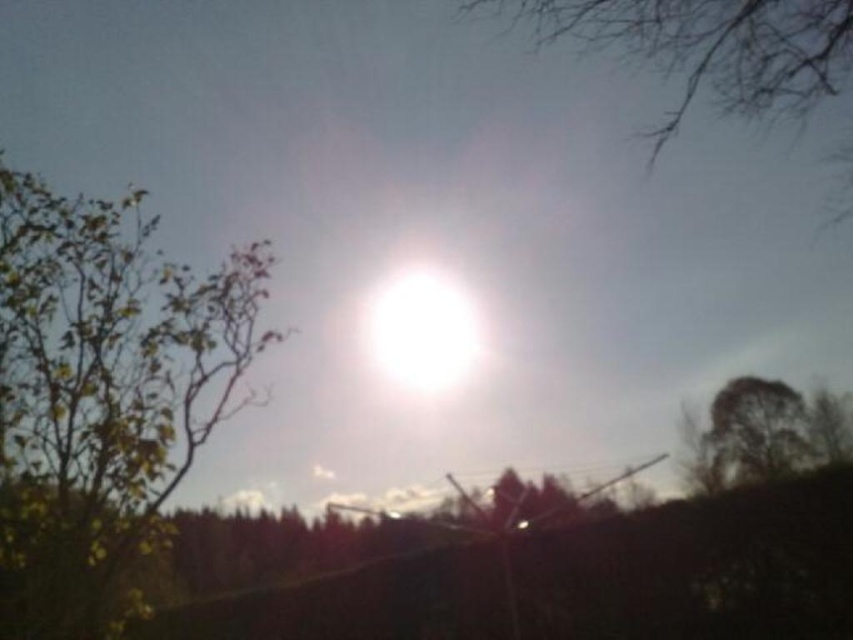
Question: Is the position of green leafy tree at left less distant than that of dark green textured tree at lower right?

Choices:
 (A) no
 (B) yes

Answer: (B)

Question: Based on their relative distances, which object is farther from the white glossy sun at center?

Choices:
 (A) green leafy tree at left
 (B) dark green textured tree at lower right

Answer: (B)

Question: Is the position of green leafy tree at left less distant than that of dark green textured tree at lower right?

Choices:
 (A) no
 (B) yes

Answer: (B)

Question: Is bare branches at upper right positioned behind dark green textured tree at lower right?

Choices:
 (A) yes
 (B) no

Answer: (B)

Question: Which of the following is the farthest from the observer?

Choices:
 (A) green leafy tree at left
 (B) white glossy sun at center
 (C) dark green textured tree at lower right
 (D) bare branches at upper right

Answer: (C)

Question: Among these objects, which one is nearest to the camera?

Choices:
 (A) dark green textured tree at lower right
 (B) green leafy tree at left

Answer: (B)